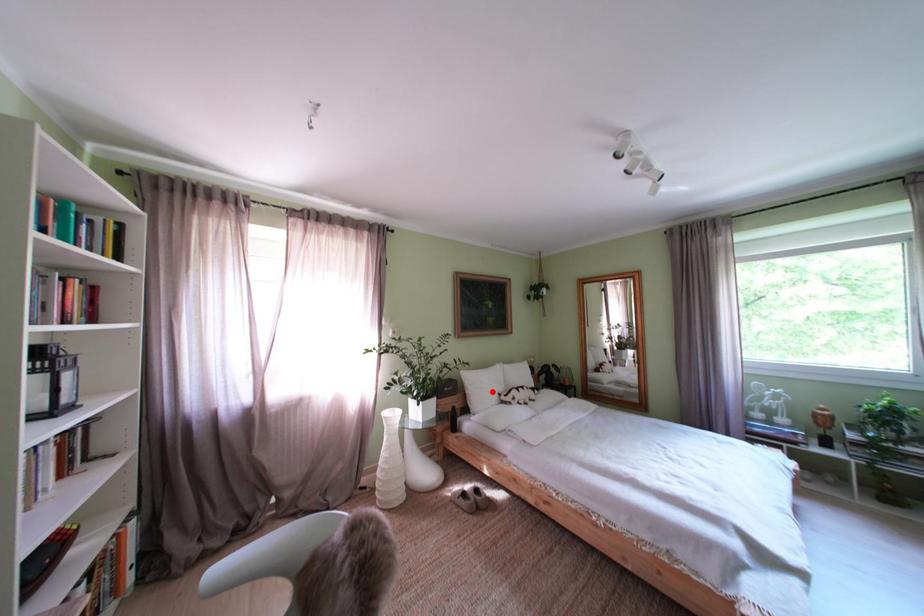
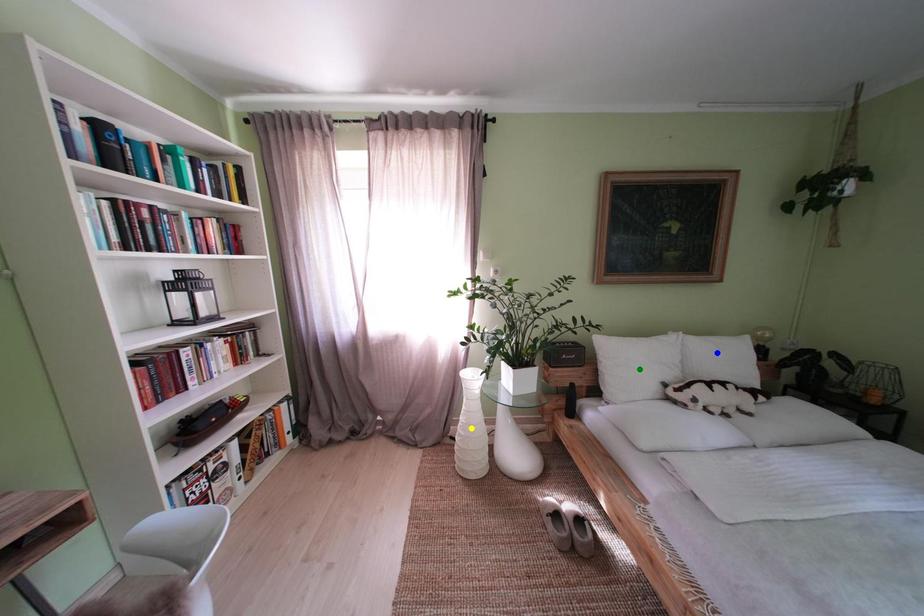
Question: I am providing you with two images of the same scene from different viewpoints. A red point is marked on the first image. You are given multiple points on the second image. Which point in image 2 is actually the same real-world point as the red point in image 1?

Choices:
 (A) blue point
 (B) yellow point
 (C) green point

Answer: (C)